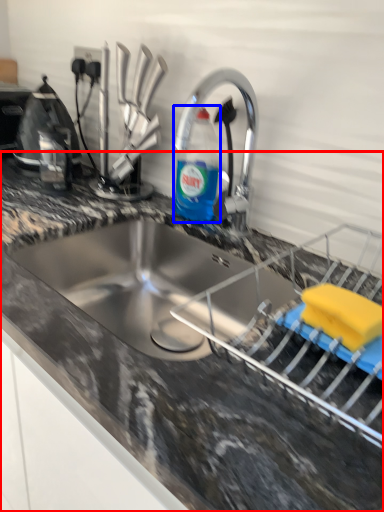
Question: Which object is further to the camera taking this photo, countertop (highlighted by a red box) or bottle (highlighted by a blue box)?

Choices:
 (A) countertop
 (B) bottle

Answer: (B)